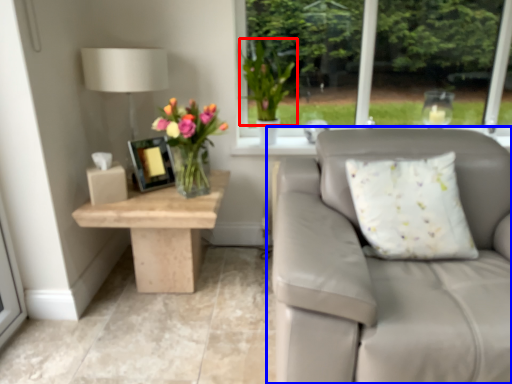
Question: Which object is further to the camera taking this photo, floral arrangement (highlighted by a red box) or studio couch (highlighted by a blue box)?

Choices:
 (A) floral arrangement
 (B) studio couch

Answer: (A)